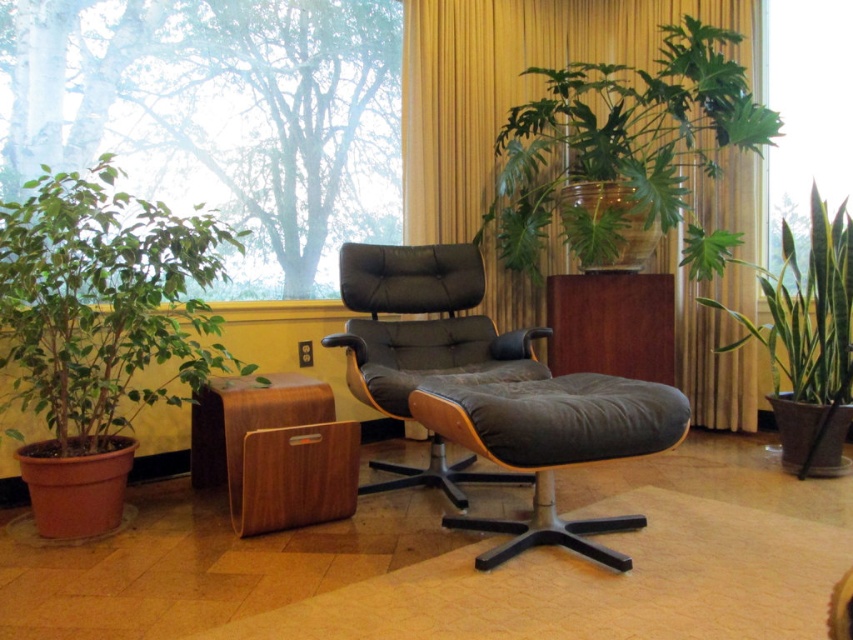
Question: Among these objects, which one is nearest to the camera?

Choices:
 (A) green glossy plant at right
 (B) green matte plant at left

Answer: (B)

Question: Which of the following is the farthest from the observer?

Choices:
 (A) leather/black swivel chair at center
 (B) green matte plant at left

Answer: (A)

Question: Observing the image, what is the correct spatial positioning of green matte plant at left in reference to suede/leather ottoman at center?

Choices:
 (A) left
 (B) right

Answer: (A)

Question: Which object is the closest to the suede/leather ottoman at center?

Choices:
 (A) mahogany wood cabinet at center
 (B) green matte plant at left
 (C) transparent glass window at upper left
 (D) green glossy plant at upper center

Answer: (B)

Question: Can you confirm if green glossy plant at right is thinner than mahogany wood cabinet at center?

Choices:
 (A) yes
 (B) no

Answer: (B)

Question: Is leather/black swivel chair at center above mahogany wood cabinet at center?

Choices:
 (A) no
 (B) yes

Answer: (B)